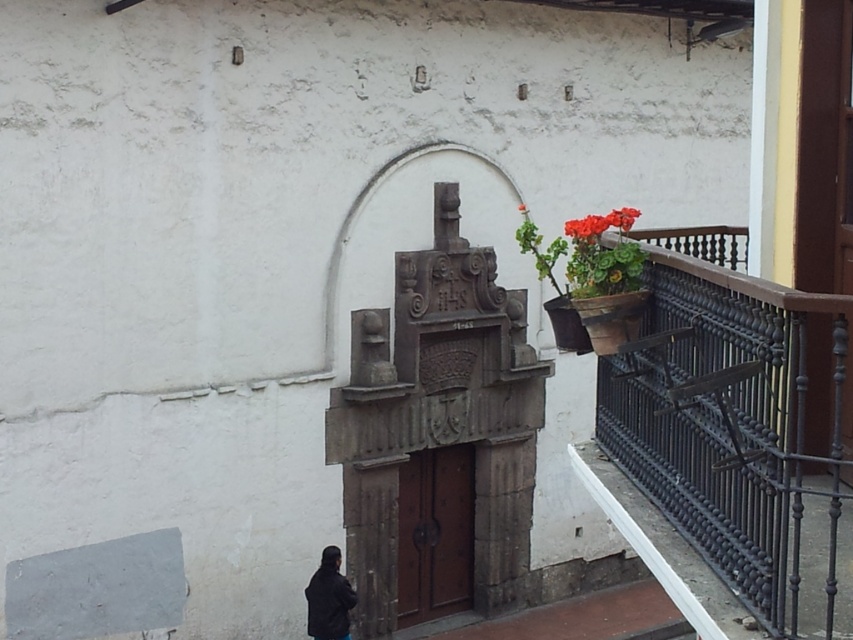
Question: Can you confirm if stone archway at center is wider than vivid red petals at upper right?

Choices:
 (A) no
 (B) yes

Answer: (B)

Question: Which is nearer to the stone archway at center?

Choices:
 (A) red matte flower at center
 (B) red matte flower at upper center
 (C) black leather jacket at lower left
 (D) black wrought iron railing at right

Answer: (A)

Question: Which of the following is the closest to the observer?

Choices:
 (A) red matte flower at upper center
 (B) vivid red petals at upper right

Answer: (A)

Question: Can you confirm if stone archway at center is smaller than black leather jacket at lower left?

Choices:
 (A) no
 (B) yes

Answer: (A)

Question: Which is nearer to the red matte flower at center?

Choices:
 (A) stone archway at center
 (B) black wrought iron railing at right
 (C) vivid red petals at upper right

Answer: (A)

Question: Does black wrought iron railing at right appear on the right side of vivid red petals at upper right?

Choices:
 (A) yes
 (B) no

Answer: (A)